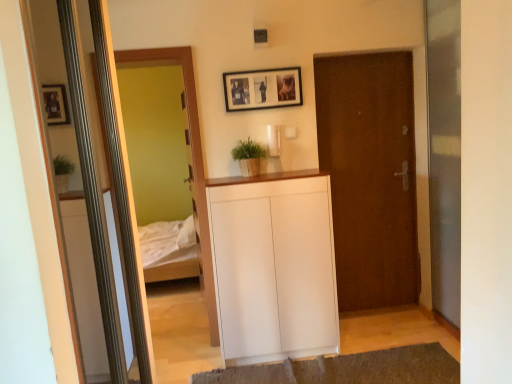
Find the location of a particular element. Image resolution: width=512 pixels, height=384 pixels. free space in front of wooden framed mirror at left is located at coordinates (183, 360).